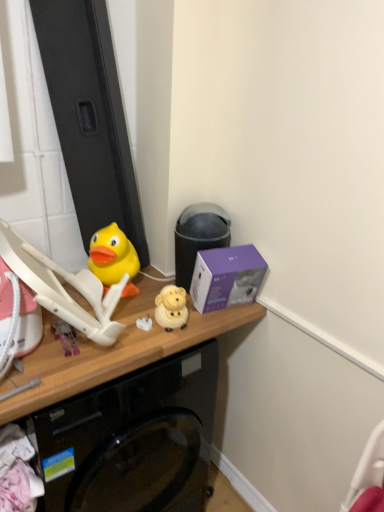
You are a GUI agent. You are given a task and a screenshot of the screen. Output one action in this format:
    pyautogui.click(x=<x>, y=<y>)
    Task: Click on the vacant area in front of yellow matte sheep at center, marked as the fourth toy in a left-to-right arrangement
    
    Given the screenshot: What is the action you would take?
    pyautogui.click(x=156, y=344)